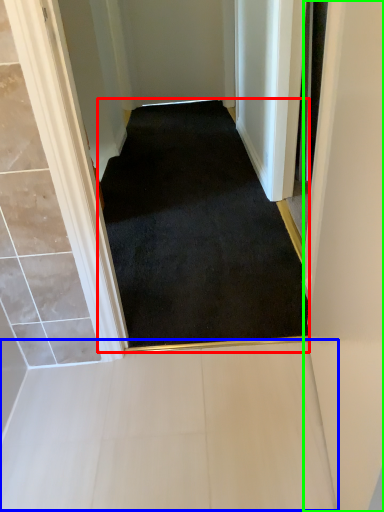
Question: Considering the real-world distances, which object is closest to doormat (highlighted by a red box)? path (highlighted by a blue box) or door (highlighted by a green box).

Choices:
 (A) path
 (B) door

Answer: (A)